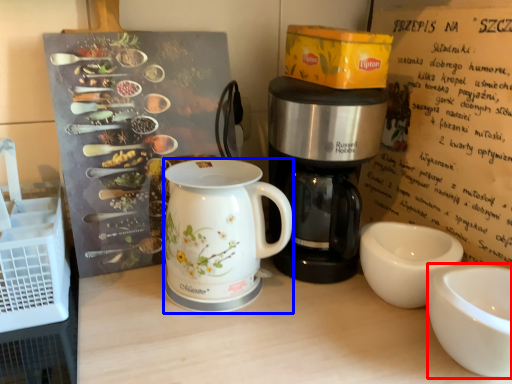
Question: Which of the following is the farthest to the observer, coffee cup (highlighted by a red box) or jug (highlighted by a blue box)?

Choices:
 (A) coffee cup
 (B) jug

Answer: (B)